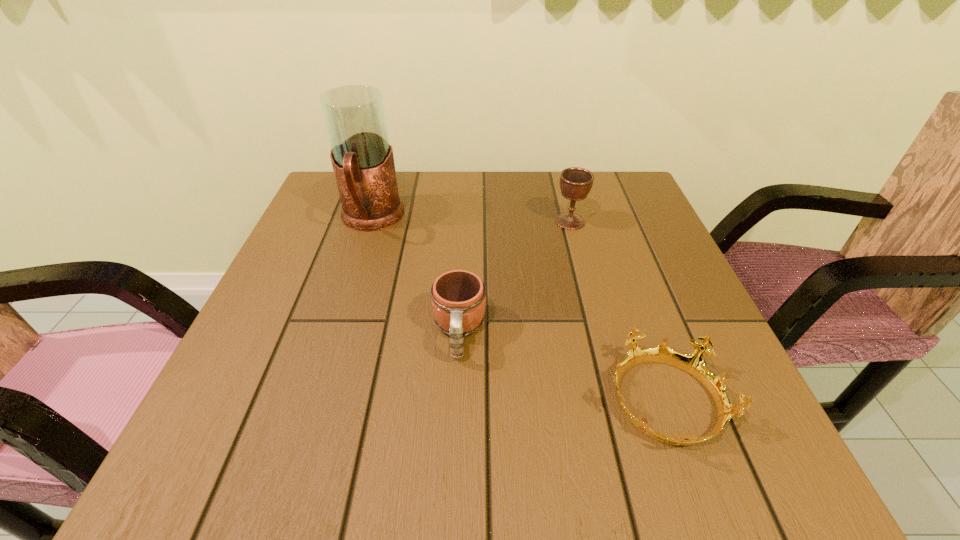
The image size is (960, 540). Find the location of `vacant space at the right edge of the desktop`. vacant space at the right edge of the desktop is located at coordinates (632, 275).

Find the location of a particular element. The width and height of the screenshot is (960, 540). vacant space at the near left corner of the desktop is located at coordinates (176, 474).

Where is `vacant space at the far right corner of the desktop`? The width and height of the screenshot is (960, 540). vacant space at the far right corner of the desktop is located at coordinates (613, 184).

Locate an element on the screen. vacant space that's between the pitcher and the shortest object is located at coordinates pos(518,311).

The height and width of the screenshot is (540, 960). I want to click on free space between the crown and the third shortest object, so click(x=617, y=312).

At what (x,y) coordinates should I click in order to perform the action: click on vacant space that's between the leftmost object and the third tallest object. Please return your answer as a coordinate pair (x, y). Image resolution: width=960 pixels, height=540 pixels. Looking at the image, I should click on (415, 276).

I want to click on free space between the mug and the pitcher, so pos(415,276).

Find the location of `free space between the second object from left to right and the second tallest object`. free space between the second object from left to right and the second tallest object is located at coordinates (515, 277).

This screenshot has height=540, width=960. I want to click on free space between the crown and the pitcher, so click(518, 311).

This screenshot has height=540, width=960. I want to click on unoccupied area between the chalice and the crown, so click(x=617, y=312).